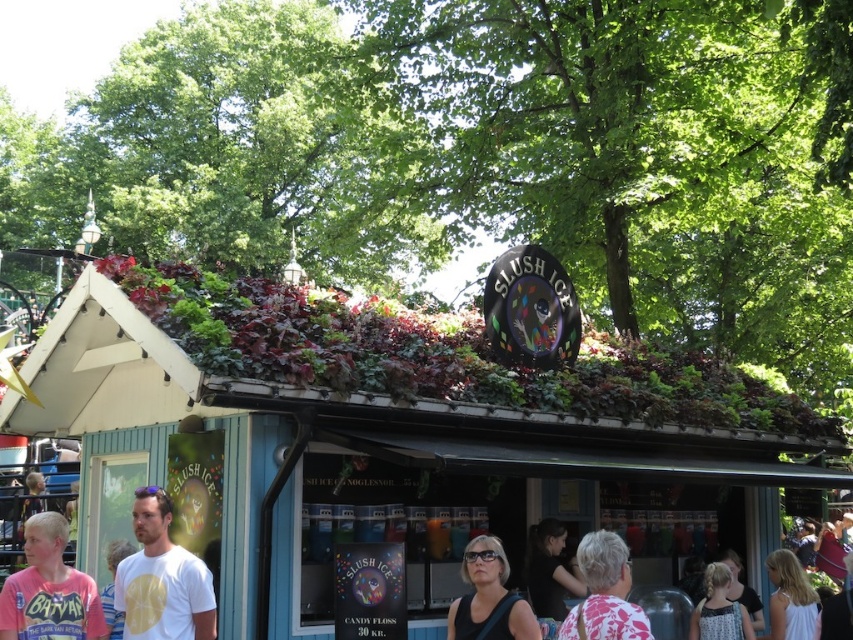
Question: Which point is farther to the camera?

Choices:
 (A) black fabric at center
 (B) floral-patterned shirt at center

Answer: (A)

Question: Which point appears closest to the camera in this image?

Choices:
 (A) (581, 556)
 (B) (552, 580)
 (C) (161, 557)
 (D) (473, 557)

Answer: (A)

Question: Among these points, which one is farthest from the camera?

Choices:
 (A) (543, 602)
 (B) (36, 570)
 (C) (149, 506)
 (D) (602, 636)

Answer: (A)

Question: Is black fabric at center below dark hair at center?

Choices:
 (A) no
 (B) yes

Answer: (A)

Question: Does pink cotton shirt at lower left appear under floral-patterned shirt at center?

Choices:
 (A) yes
 (B) no

Answer: (A)

Question: Does white matte t-shirt at lower left appear over dark hair at center?

Choices:
 (A) no
 (B) yes

Answer: (B)